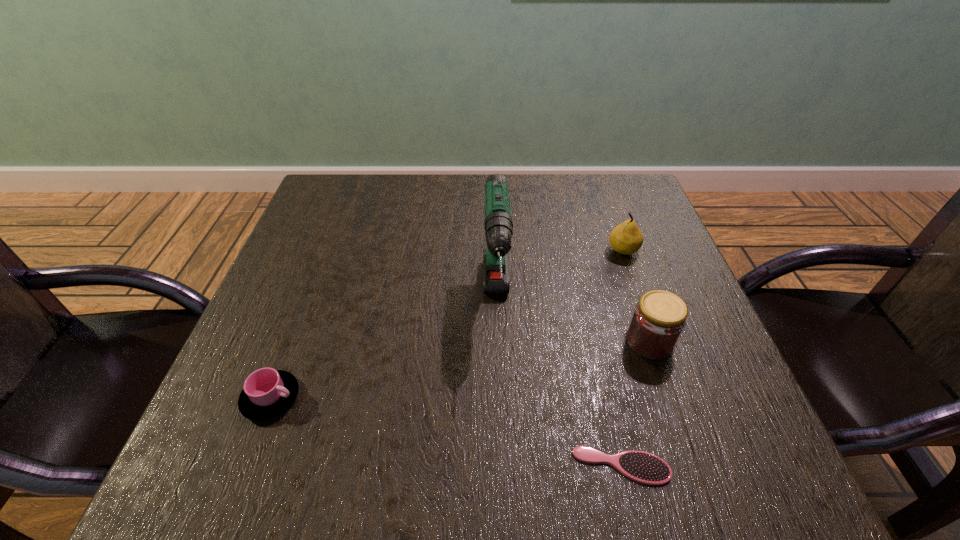
Identify the location of free space that satisfies the following two spatial constraints: 1. on the handle side of the tallest object; 2. on the side with the handle of the second shortest object. (500, 398).

The width and height of the screenshot is (960, 540). Identify the location of vacant space that satisfies the following two spatial constraints: 1. on the side with the handle of the shortest object; 2. on the left side of the cup. (245, 466).

I want to click on vacant space that satisfies the following two spatial constraints: 1. on the handle side of the drill; 2. on the side with the handle of the second nearest object, so click(500, 398).

The width and height of the screenshot is (960, 540). What are the coordinates of `vacant area that satisfies the following two spatial constraints: 1. on the side with the handle of the nearest object; 2. on the right side of the cup` in the screenshot? It's located at (245, 466).

Identify the location of free spot that satisfies the following two spatial constraints: 1. on the handle side of the drill; 2. on the side with the handle of the fourth tallest object. (500, 398).

You are a GUI agent. You are given a task and a screenshot of the screen. Output one action in this format:
    pyautogui.click(x=<x>, y=<y>)
    Task: Click on the free space that satisfies the following two spatial constraints: 1. on the handle side of the nearest object; 2. on the right side of the tallest object
    
    Given the screenshot: What is the action you would take?
    pyautogui.click(x=502, y=466)

The image size is (960, 540). Identify the location of vacant point that satisfies the following two spatial constraints: 1. on the back side of the shortest object; 2. on the right side of the pear. (572, 251).